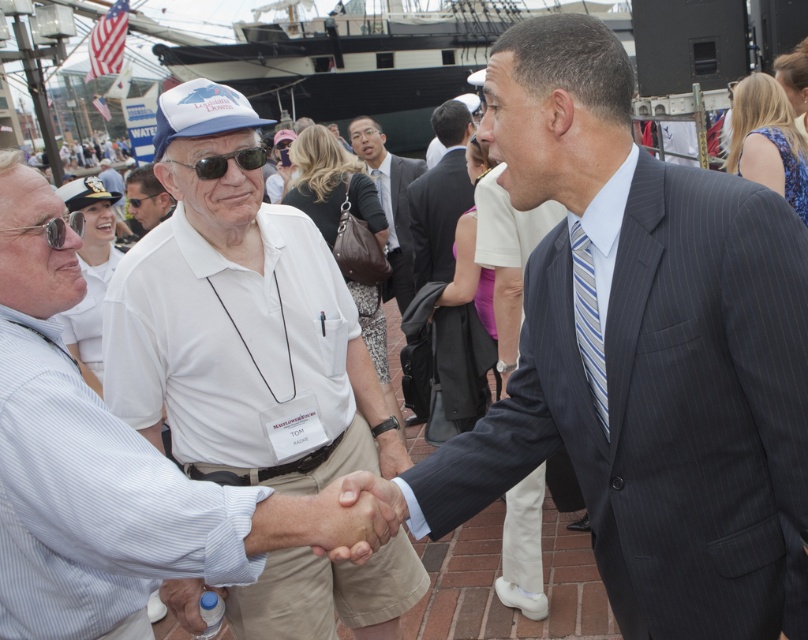
You are a photographer positioned at the edge of the crowd, aiming to capture a clear photo of both the dark gray pinstripe suit at center and the light blue striped tie at center. Given that your camera has a minimum focus distance of 5 meters, will you be able to capture both subjects in focus without moving closer?

The distance between the dark gray pinstripe suit at center and the light blue striped tie at center is 7.20 meters. Since your camera requires a minimum focus distance of 5 meters, you can capture both subjects in focus as the distance between them exceeds the minimum requirement.

You are a photographer at the event and need to capture a photo of the dark gray pinstripe suit at center and the light blue striped tie at center. Which of the two items is wider?

The dark gray pinstripe suit at center is wider than the light blue striped tie at center.

You are a photographer at the event and want to capture a photo of both the white matte shirt at center and the light blue striped tie at center. Which object should you focus on first if you want to include both in the frame without moving the camera?

The white matte shirt at center is positioned on the left side of light blue striped tie at center, so you should focus on the white matte shirt at center first to ensure both are in the frame.